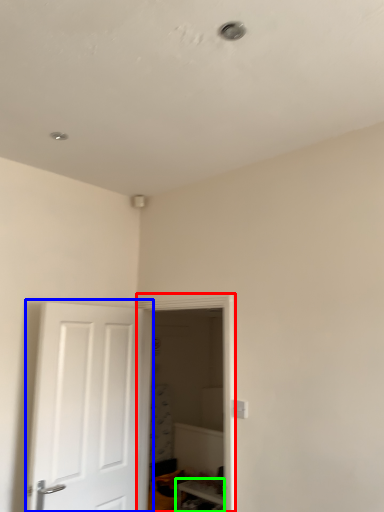
Question: Which object is the farthest from glass door (highlighted by a red box)? Choose among these: door (highlighted by a blue box) or furniture (highlighted by a green box).

Choices:
 (A) door
 (B) furniture

Answer: (B)